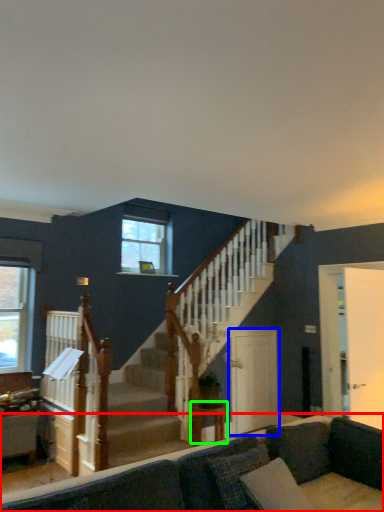
Question: Which object is the closest to the studio couch (highlighted by a red box)? Choose among these: screen door (highlighted by a blue box) or table (highlighted by a green box).

Choices:
 (A) screen door
 (B) table

Answer: (B)